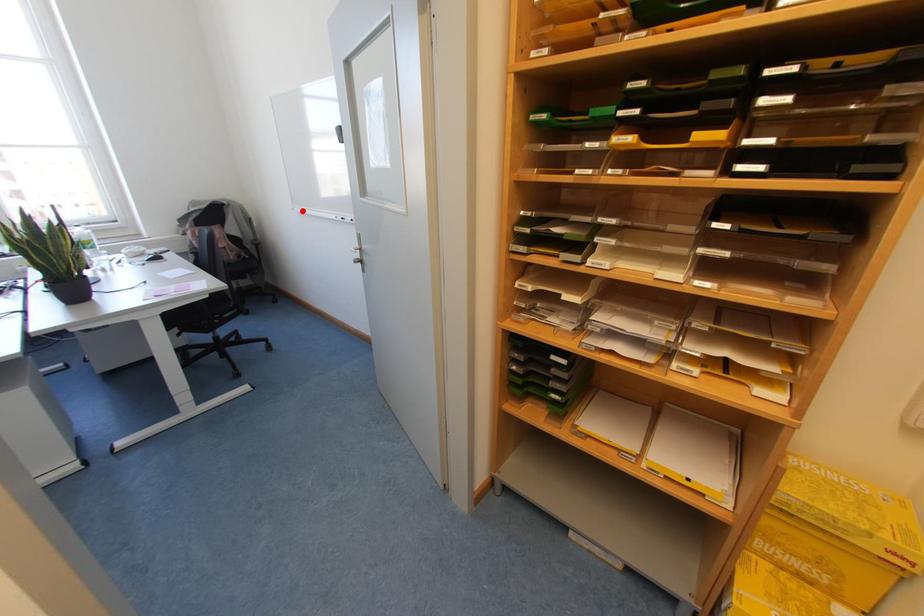
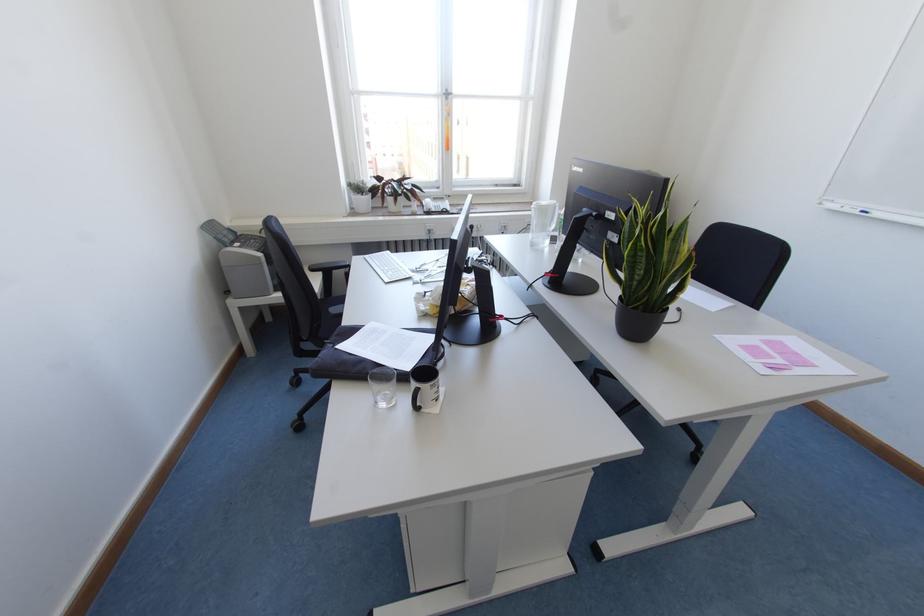
In the second image, find the point that corresponds to the highlighted location in the first image.

(864, 213)